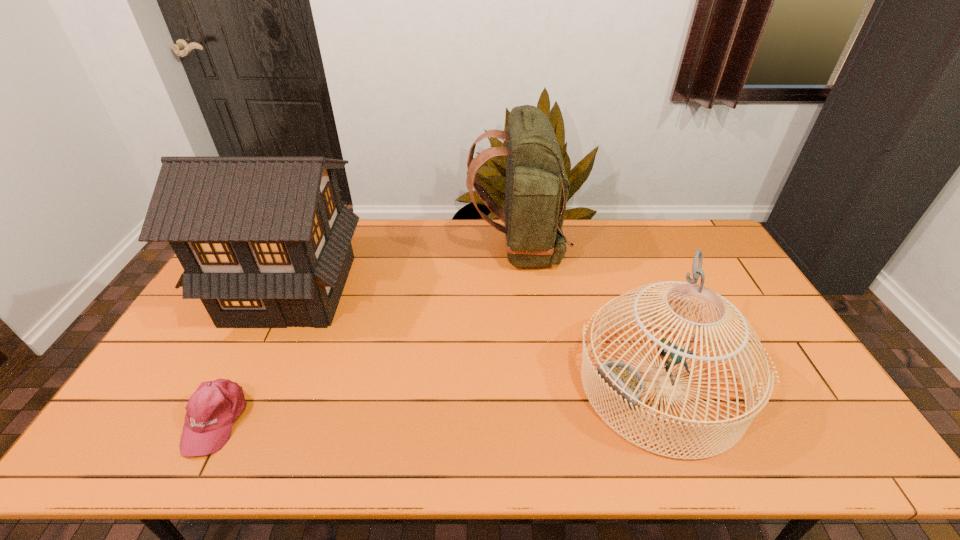
The image size is (960, 540). What are the coordinates of `empty space between the backpack and the dollhouse` in the screenshot? It's located at (404, 269).

Identify which object is the closest to the backpack. Please provide its 2D coordinates. Your answer should be formatted as a tuple, i.e. [(x, y)], where the tuple contains the x and y coordinates of a point satisfying the conditions above.

[(627, 382)]

Identify the location of object that stands as the second closest to the baseball cap. (536, 191).

You are a GUI agent. You are given a task and a screenshot of the screen. Output one action in this format:
    pyautogui.click(x=<x>, y=<y>)
    Task: Click on the vacant space that satisfies the following two spatial constraints: 1. on the front-facing side of the birdcage; 2. on the right side of the dollhouse
    
    Given the screenshot: What is the action you would take?
    pyautogui.click(x=246, y=383)

I want to click on vacant point that satisfies the following two spatial constraints: 1. on the back of the backpack; 2. on the front-facing side of the dollhouse, so click(521, 289).

This screenshot has height=540, width=960. Find the location of `free region that satisfies the following two spatial constraints: 1. on the back of the backpack; 2. on the back side of the birdcage`. free region that satisfies the following two spatial constraints: 1. on the back of the backpack; 2. on the back side of the birdcage is located at coordinates (532, 383).

Locate an element on the screen. vacant space that satisfies the following two spatial constraints: 1. on the back of the backpack; 2. at the front of the baseball cap with the brim is located at coordinates (536, 420).

Where is `free space that satisfies the following two spatial constraints: 1. on the back of the backpack; 2. on the front-facing side of the dollhouse`? This screenshot has height=540, width=960. free space that satisfies the following two spatial constraints: 1. on the back of the backpack; 2. on the front-facing side of the dollhouse is located at coordinates (521, 289).